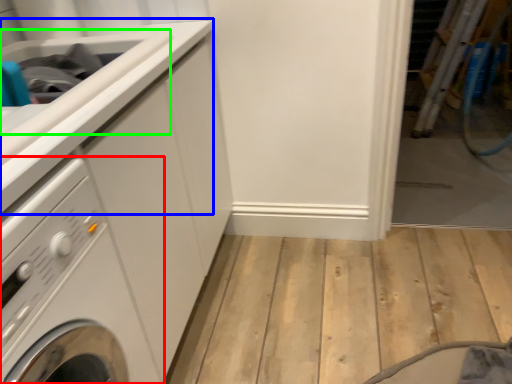
Question: Estimate the real-world distances between objects in this image. Which object is closer to washing machine (highlighted by a red box), counter top (highlighted by a blue box) or sink (highlighted by a green box)?

Choices:
 (A) counter top
 (B) sink

Answer: (A)